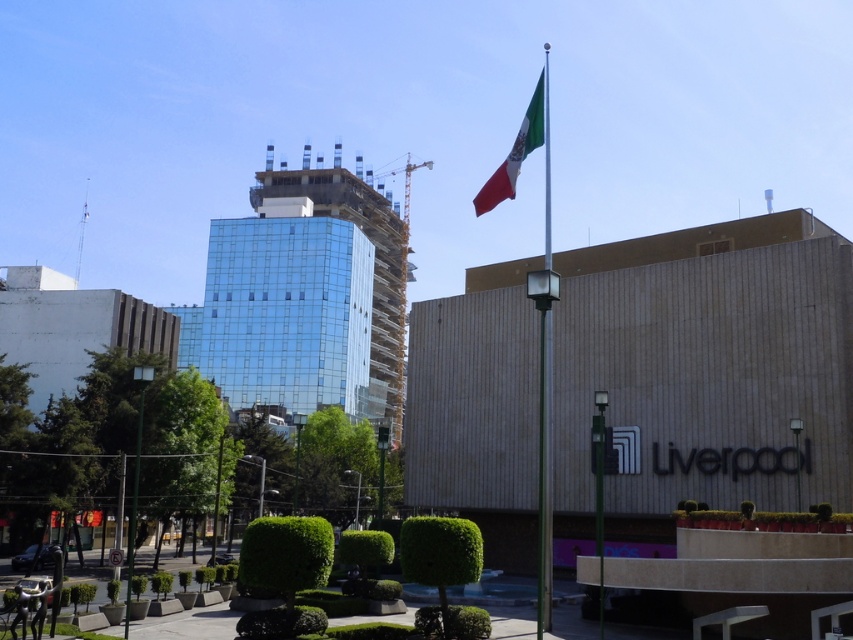
You are a city planner assessing the urban space. You need to determine if the transparent glass building at center can be seen from the green and white fabric flag at upper right without any obstruction. Can you confirm this?

The transparent glass building at center is wider than the green and white fabric flag at upper right. Since the building is wider, it might block the view from the flag to the building. However, the flag is positioned at upper right, which is above and to the side of the building. The description does not mention any obstructions, so the flag should have an unobstructed view of the transparent glass building at center.

You are a city planner analyzing the urban layout. You see the point labeled at coordinates [305,298]. What does this point indicate?

The point labeled at coordinates [305,298] indicates the location of the transparent glass building at center.

You are a city planner reviewing the urban scene. You need to determine the spatial relationship between the silver metallic flag pole at center and the green and white fabric flag at upper right. Which object is positioned higher in the image?

The green and white fabric flag at upper right is positioned higher in the image than the silver metallic flag pole at center.